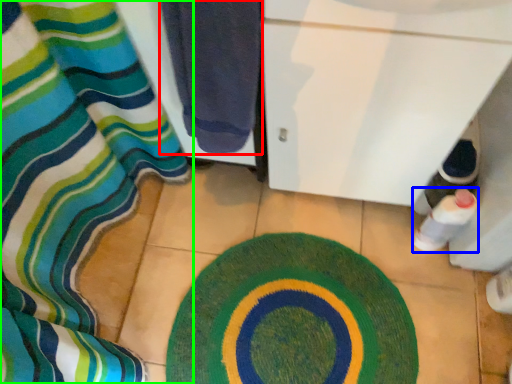
Question: Which is farther away from towel (highlighted by a red box)? bottle (highlighted by a blue box) or curtain (highlighted by a green box)?

Choices:
 (A) bottle
 (B) curtain

Answer: (A)